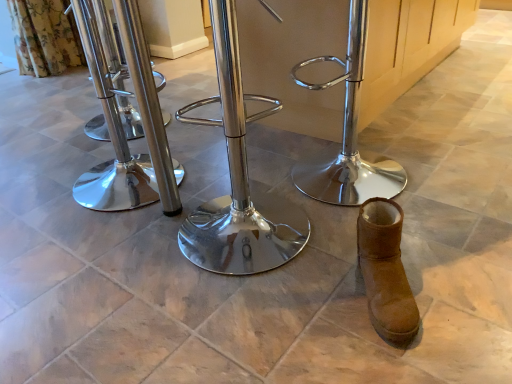
This screenshot has width=512, height=384. Identify the location of vacant area that is in front of brown suede boot at lower right. (408, 355).